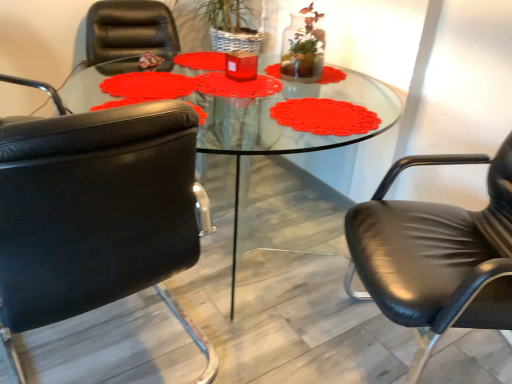
Question: Can we say translucent glass vase at upper center lies outside transparent glass table at center?

Choices:
 (A) no
 (B) yes

Answer: (B)

Question: Can you confirm if translucent glass vase at upper center is positioned to the right of transparent glass table at center?

Choices:
 (A) no
 (B) yes

Answer: (B)

Question: Can you confirm if translucent glass vase at upper center is thinner than transparent glass table at center?

Choices:
 (A) yes
 (B) no

Answer: (A)

Question: Are translucent glass vase at upper center and transparent glass table at center making contact?

Choices:
 (A) no
 (B) yes

Answer: (A)

Question: Does translucent glass vase at upper center come in front of transparent glass table at center?

Choices:
 (A) yes
 (B) no

Answer: (B)

Question: Considering the positions of black leather chair at left, the first chair from the left, and black leather chair at right, which is the 2th chair in left-to-right order, in the image, is black leather chair at left, the first chair from the left, taller or shorter than black leather chair at right, which is the 2th chair in left-to-right order,?

Choices:
 (A) tall
 (B) short

Answer: (B)

Question: From a real-world perspective, is black leather chair at left, the first chair from the left, above or below black leather chair at right, which is the 2th chair in left-to-right order?

Choices:
 (A) above
 (B) below

Answer: (B)

Question: Is black leather chair at left, the 2th chair in the right-to-left sequence, spatially inside black leather chair at right, marked as the first chair in a right-to-left arrangement, or outside of it?

Choices:
 (A) inside
 (B) outside

Answer: (B)

Question: In the image, is black leather chair at left, the first chair from the left, positioned in front of or behind black leather chair at right, which is the 2th chair in left-to-right order?

Choices:
 (A) front
 (B) behind

Answer: (A)

Question: In the image, is black leather chair at right, marked as the first chair in a right-to-left arrangement, on the left side or the right side of transparent glass table at center?

Choices:
 (A) left
 (B) right

Answer: (B)

Question: Considering the positions of black leather chair at right, marked as the first chair in a right-to-left arrangement, and transparent glass table at center in the image, is black leather chair at right, marked as the first chair in a right-to-left arrangement, bigger or smaller than transparent glass table at center?

Choices:
 (A) big
 (B) small

Answer: (B)

Question: Considering the positions of black leather chair at right, marked as the first chair in a right-to-left arrangement, and transparent glass table at center in the image, is black leather chair at right, marked as the first chair in a right-to-left arrangement, taller or shorter than transparent glass table at center?

Choices:
 (A) short
 (B) tall

Answer: (B)

Question: Considering their positions, is black leather chair at right, which is the 2th chair in left-to-right order, located in front of or behind transparent glass table at center?

Choices:
 (A) behind
 (B) front

Answer: (B)

Question: From the image's perspective, is transparent glass table at center positioned above or below black leather chair at right, which is the 2th chair in left-to-right order?

Choices:
 (A) above
 (B) below

Answer: (A)

Question: Would you say transparent glass table at center is to the left or to the right of black leather chair at right, marked as the first chair in a right-to-left arrangement, in the picture?

Choices:
 (A) right
 (B) left

Answer: (B)